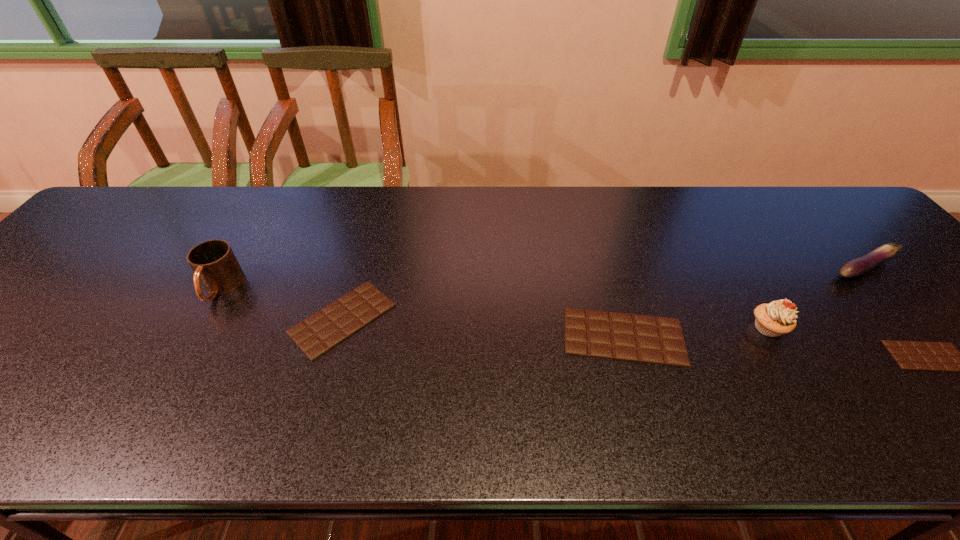
Where is `the fifth tallest object`? The image size is (960, 540). the fifth tallest object is located at coordinates (317, 334).

The width and height of the screenshot is (960, 540). Identify the location of the leftmost chocolate bar. (317, 334).

This screenshot has height=540, width=960. Find the location of `the fourth object from right to left`. the fourth object from right to left is located at coordinates (599, 334).

In order to click on the leftmost object in this screenshot , I will do `click(214, 264)`.

Locate an element on the screen. This screenshot has width=960, height=540. cupcake is located at coordinates (777, 318).

This screenshot has width=960, height=540. I want to click on eggplant, so click(x=859, y=266).

Identify the location of free space located on the right of the second object from left to right. (522, 319).

This screenshot has height=540, width=960. In order to click on vacant space situated 0.390m on the back of the second chocolate bar from right to left in this screenshot , I will do `click(588, 211)`.

Where is `free point located 0.100m on the side of the mug with the handle`? This screenshot has width=960, height=540. free point located 0.100m on the side of the mug with the handle is located at coordinates (188, 343).

Identify the location of vacant area located 0.130m on the front of the cupcake. (807, 395).